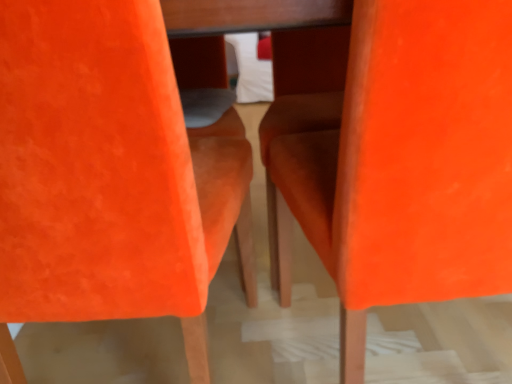
Question: Is the position of orange suede chair at center, the 2th chair when ordered from right to left, less distant than that of orange velvet chair at center, arranged as the 2th chair when viewed from the left?

Choices:
 (A) yes
 (B) no

Answer: (A)

Question: Considering the relative sizes of orange suede chair at center, which is counted as the 1th chair, starting from the left, and orange velvet chair at center, arranged as the 2th chair when viewed from the left, in the image provided, is orange suede chair at center, which is counted as the 1th chair, starting from the left, smaller than orange velvet chair at center, arranged as the 2th chair when viewed from the left,?

Choices:
 (A) yes
 (B) no

Answer: (A)

Question: Is orange suede chair at center, which is counted as the 1th chair, starting from the left, turned away from orange velvet chair at center, arranged as the 2th chair when viewed from the left?

Choices:
 (A) yes
 (B) no

Answer: (B)

Question: From a real-world perspective, is orange suede chair at center, which is counted as the 1th chair, starting from the left, positioned over orange velvet chair at center, placed as the first chair when sorted from right to left, based on gravity?

Choices:
 (A) yes
 (B) no

Answer: (A)

Question: Is orange suede chair at center, which is counted as the 1th chair, starting from the left, shorter than orange velvet chair at center, placed as the first chair when sorted from right to left?

Choices:
 (A) yes
 (B) no

Answer: (B)

Question: Is orange suede chair at center, the 2th chair when ordered from right to left, taller than orange velvet chair at center, placed as the first chair when sorted from right to left?

Choices:
 (A) no
 (B) yes

Answer: (B)

Question: From the image's perspective, is orange velvet chair at center, placed as the first chair when sorted from right to left, below orange suede chair at center, which is counted as the 1th chair, starting from the left?

Choices:
 (A) yes
 (B) no

Answer: (B)

Question: Can you confirm if orange velvet chair at center, arranged as the 2th chair when viewed from the left, is wider than orange suede chair at center, which is counted as the 1th chair, starting from the left?

Choices:
 (A) no
 (B) yes

Answer: (A)

Question: Does orange velvet chair at center, placed as the first chair when sorted from right to left, have a smaller size compared to orange suede chair at center, the 2th chair when ordered from right to left?

Choices:
 (A) yes
 (B) no

Answer: (B)

Question: Is orange velvet chair at center, arranged as the 2th chair when viewed from the left, behind orange suede chair at center, the 2th chair when ordered from right to left?

Choices:
 (A) yes
 (B) no

Answer: (A)

Question: Considering the relative sizes of orange velvet chair at center, arranged as the 2th chair when viewed from the left, and orange suede chair at center, the 2th chair when ordered from right to left, in the image provided, is orange velvet chair at center, arranged as the 2th chair when viewed from the left, bigger than orange suede chair at center, the 2th chair when ordered from right to left,?

Choices:
 (A) no
 (B) yes

Answer: (B)

Question: Can you confirm if orange velvet chair at center, placed as the first chair when sorted from right to left, is positioned to the right of orange suede chair at center, the 2th chair when ordered from right to left?

Choices:
 (A) no
 (B) yes

Answer: (B)

Question: Considering the positions of orange suede chair at center, the 2th chair when ordered from right to left, and orange velvet chair at center, placed as the first chair when sorted from right to left, in the image, is orange suede chair at center, the 2th chair when ordered from right to left, bigger or smaller than orange velvet chair at center, placed as the first chair when sorted from right to left,?

Choices:
 (A) big
 (B) small

Answer: (B)